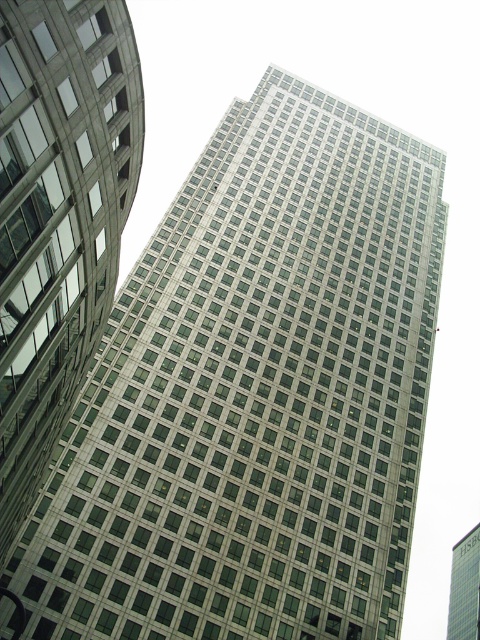
Question: Is metallic glass skyscraper at center positioned at the back of green glass skyscraper at center?

Choices:
 (A) yes
 (B) no

Answer: (B)

Question: Is the position of metallic glass skyscraper at center less distant than that of green glass skyscraper at center?

Choices:
 (A) yes
 (B) no

Answer: (A)

Question: Which object appears farthest from the camera in this image?

Choices:
 (A) metallic glass skyscraper at center
 (B) green glass skyscraper at center

Answer: (B)

Question: Is metallic glass skyscraper at center to the right of green glass skyscraper at center from the viewer's perspective?

Choices:
 (A) yes
 (B) no

Answer: (B)